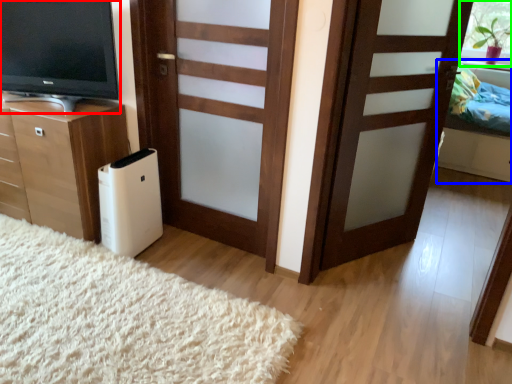
Question: Based on their relative distances, which object is farther from television (highlighted by a red box)? Choose from bed (highlighted by a blue box) and window screen (highlighted by a green box).

Choices:
 (A) bed
 (B) window screen

Answer: (B)